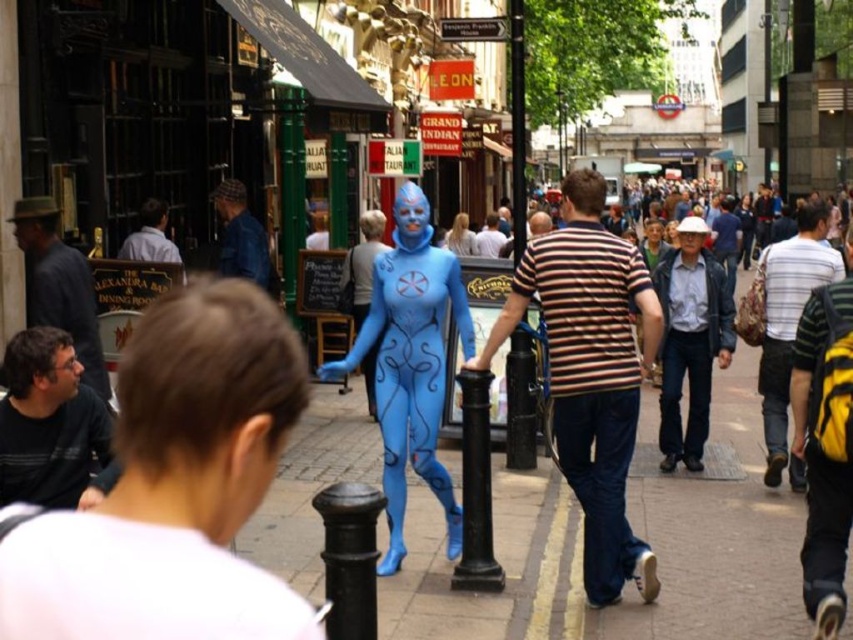
From the picture: You are a photographer trying to capture both the striped cotton shirt at center and the matte black shirt at lower left in a single shot. Which shirt should you position your camera closer to in order to include both in the frame?

You should position your camera closer to the matte black shirt at lower left because the striped cotton shirt at center is to the right of it, so centering the camera between them would ensure both are in the frame.

You are a drone operator trying to capture a clear photo of both the blue matte face at center and the matte blue face at center. The drone has a maximum focus range of 30 meters. Can you capture both faces in focus at the same time?

The distance between the blue matte face at center and the matte blue face at center is 35.04 meters, which exceeds the drone camera focus range of 30 meters. Therefore, both faces cannot be in focus simultaneously.